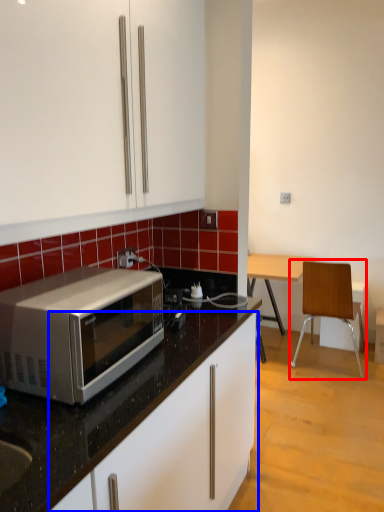
Question: Among these objects, which one is farthest to the camera, chair (highlighted by a red box) or cabinetry (highlighted by a blue box)?

Choices:
 (A) chair
 (B) cabinetry

Answer: (A)